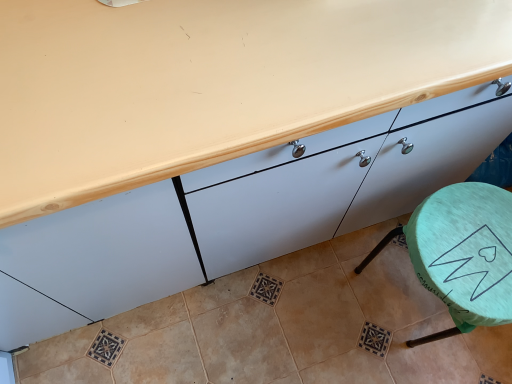
The height and width of the screenshot is (384, 512). In order to click on vacant area that is in front of green fabric stool at lower right in this screenshot , I will do `click(428, 365)`.